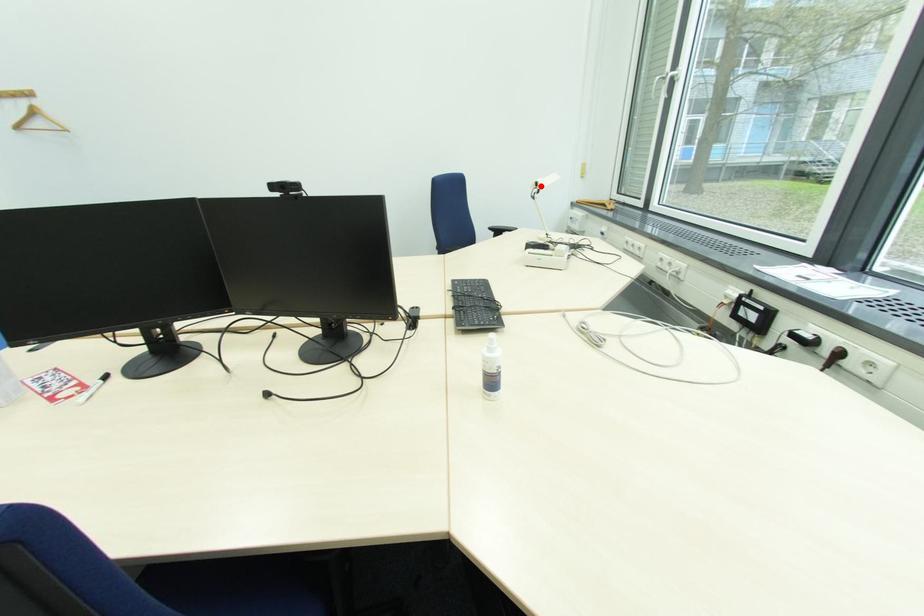
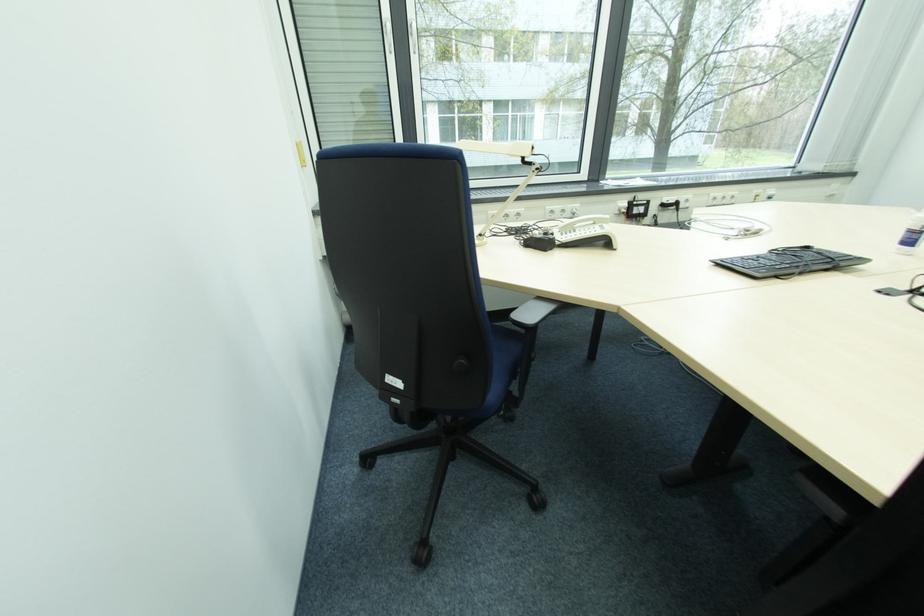
In the second image, find the point that corresponds to the highlighted location in the first image.

(535, 150)